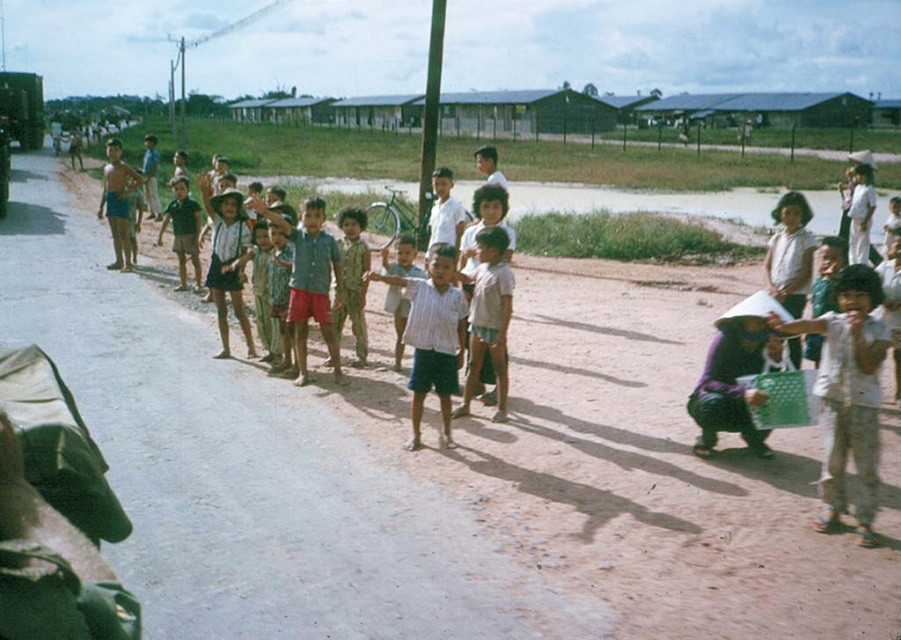
You are a photographer trying to capture a group photo of the children in the scene. You need to ensure that both the white cotton shirt at center and the striped shirt at center are in focus. Given that your camera can focus on objects within a 2 meter range, will both shirts be in focus?

The white cotton shirt at center and striped shirt at center are 2.27 meters apart from each other. Since the distance between them exceeds the camera focus range of 2 meters, not both shirts will be in focus.

You are a photographer trying to capture both the white cotton shirt at center and the striped shirt at center in a single shot. Which shirt should you focus on first to ensure both are in frame?

You should focus on the striped shirt at center first because the white cotton shirt at center is located below it, ensuring both will be captured in the frame.

You are a photographer trying to capture a group photo of the children. You notice two shirts in the center of the image, a white cotton shirt at center and a striped shirt at center. Which shirt should you position slightly to the left to ensure both are centered in the frame?

You should position the striped shirt at center slightly to the left because the white cotton shirt at center is currently to the right of the striped shirt at center, so moving the striped shirt left would help center both shirts in the frame.